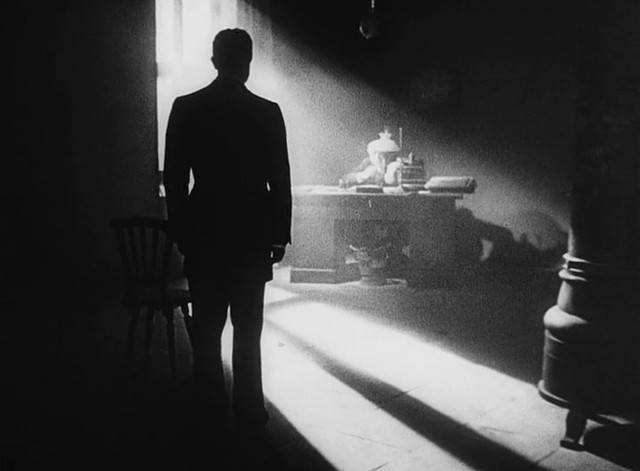
This screenshot has width=640, height=471. In order to click on chair in this screenshot , I will do `click(157, 283)`, `click(138, 296)`, `click(134, 228)`.